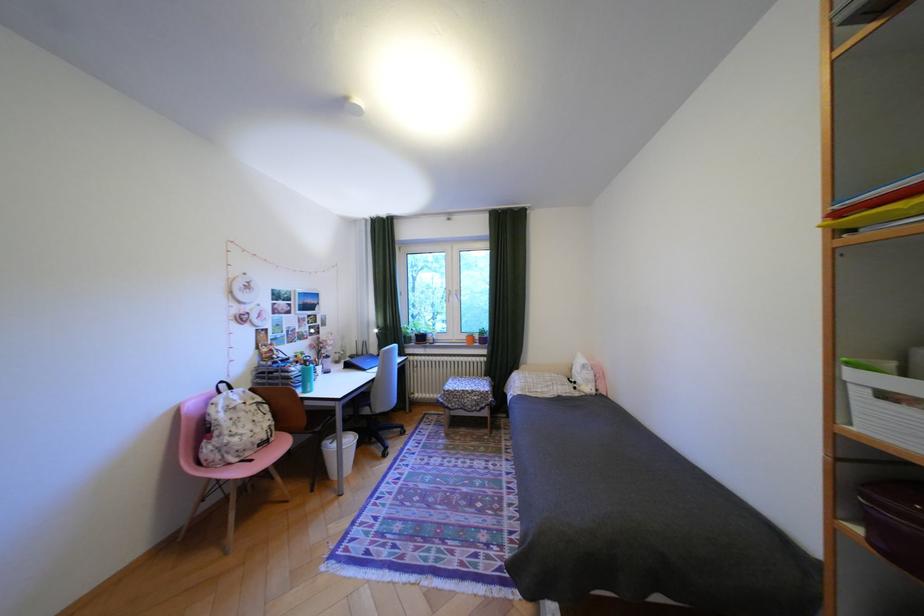
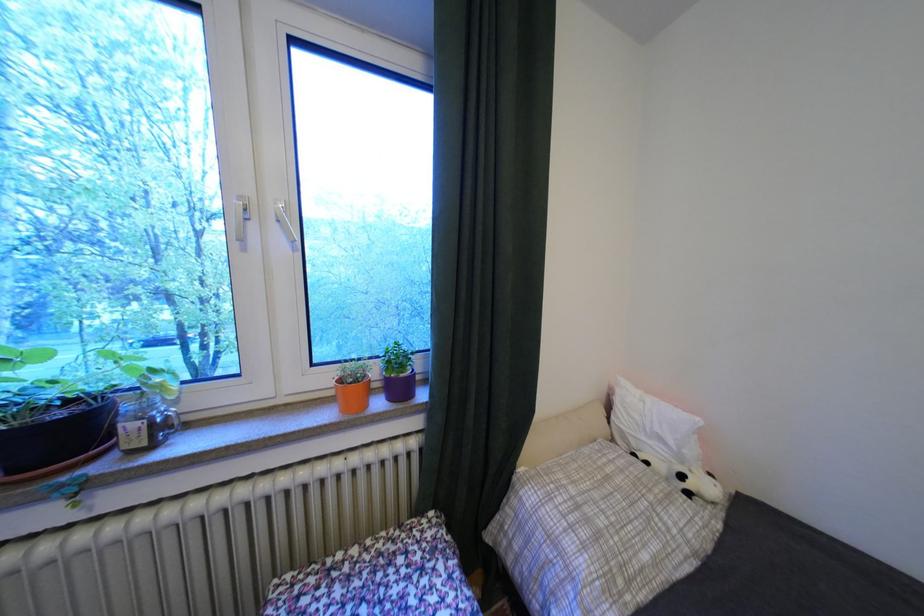
In the second image, find the point that corresponds to (553,392) in the first image.

(667, 562)